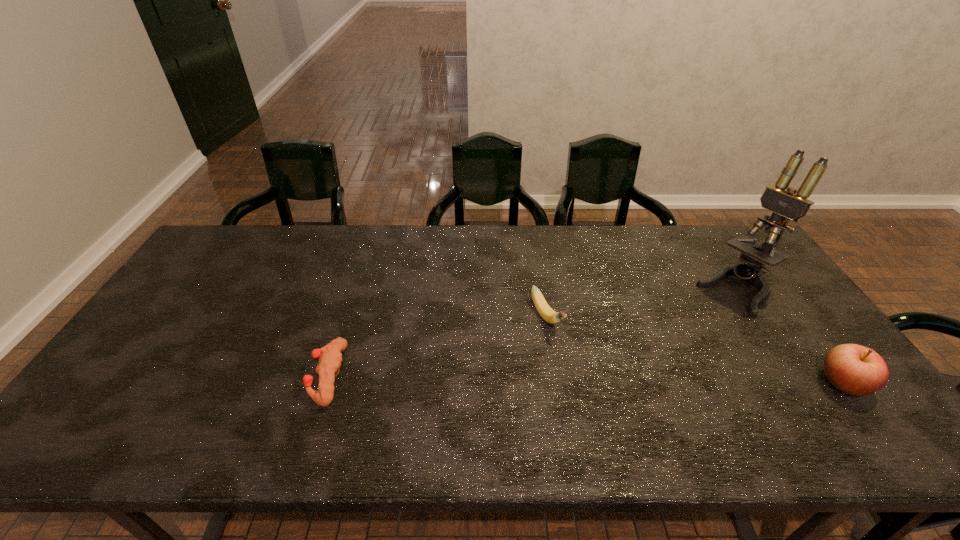
This screenshot has width=960, height=540. I want to click on the shortest object, so click(x=330, y=355).

The width and height of the screenshot is (960, 540). In order to click on the leftmost object in this screenshot , I will do `click(330, 355)`.

Find the location of a particular element. The height and width of the screenshot is (540, 960). apple is located at coordinates (857, 370).

Where is `banana`? banana is located at coordinates (545, 311).

Where is `the second object from left to right`? The image size is (960, 540). the second object from left to right is located at coordinates (x=545, y=311).

At what (x,y) coordinates should I click in order to perform the action: click on the tallest object. Please return your answer as a coordinate pair (x, y). Image resolution: width=960 pixels, height=540 pixels. Looking at the image, I should click on (791, 204).

Locate an element on the screen. This screenshot has width=960, height=540. vacant space located with the gloves of the shortest object facing forward is located at coordinates (228, 376).

Locate an element on the screen. The width and height of the screenshot is (960, 540). blank area located 0.210m with the gloves of the shortest object facing forward is located at coordinates (228, 376).

Locate an element on the screen. The height and width of the screenshot is (540, 960). vacant space positioned 0.170m with the gloves of the shortest object facing forward is located at coordinates (245, 376).

Locate an element on the screen. vacant space situated on the left of the second tallest object is located at coordinates 762,383.